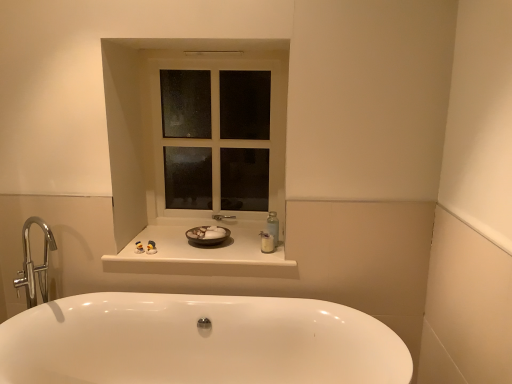
Identify the location of free location above white glossy counter top at center (from a real-world perspective). (193, 249).